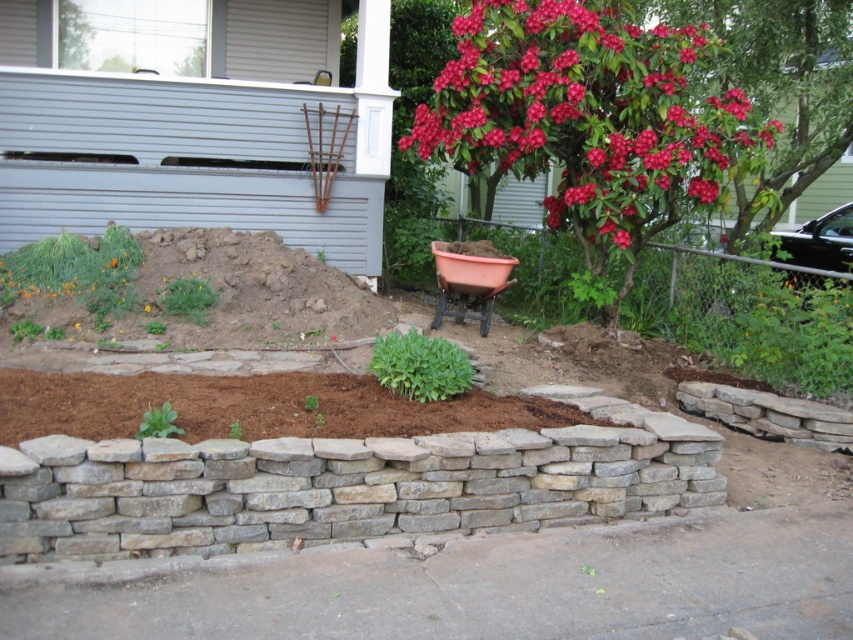
From the picture: You are a landscape architect designing a garden layout. You need to place a new statue exactly at the center of the garden area. The garden area is defined as the region behind the stone retaining wall. Where should you place the statue relative to the red glossy flower at upper right?

The red glossy flower at upper right is located at point (x=589, y=116). To place the statue at the center of the garden area behind the wall, you would need to calculate the midpoint of that region and ensure it doesn not align directly with the flower unless desired.

You are a gardener who wants to place a new plant in the garden. You have a terracotta clay pot at center and brown mulch at center. According to the scene, where should you place the mulch relative to the pot?

The brown mulch at center should be placed below the terracotta clay pot at center as per the description.

You are a gardener who wants to plant a new flower in the garden. You have a red glossy flower at upper right and a terracotta clay pot at center. Which object is wider?

The red glossy flower at upper right is wider than the terracotta clay pot at center.